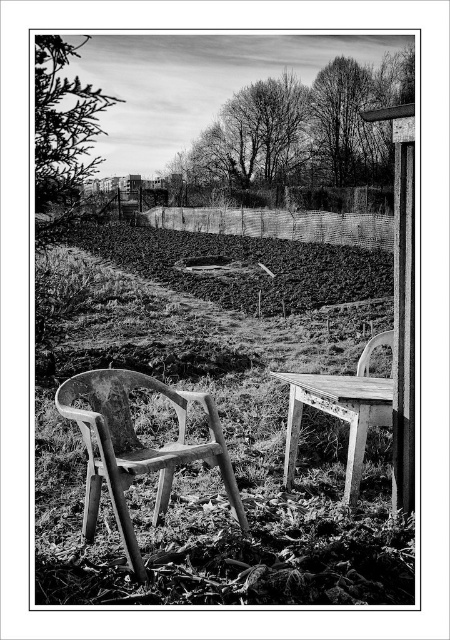
You are standing in the scene depicted in the image. You want to take a photo of the bare branches at upper center using a camera with a focal length of 50mm. To ensure the branches fill the frame appropriately, you need to be exactly 2.5 meters away. Based on the description, should you move closer or farther away?

The bare branches at upper center is 2.48 meters away from viewer. Since you need to be exactly 2.5 meters away, you should move slightly farther away to reach the required distance.

You are a park ranger planning to plant a new tree between the bare branches at upper center and the green leafy tree at upper left. Given that the minimum recommended spacing between trees is 30 feet, will there be enough space?

The distance between the bare branches at upper center and the green leafy tree at upper left is 29.58 feet, which is slightly less than the recommended 30 feet. Therefore, there is not enough space to plant a new tree between them following the spacing guidelines.